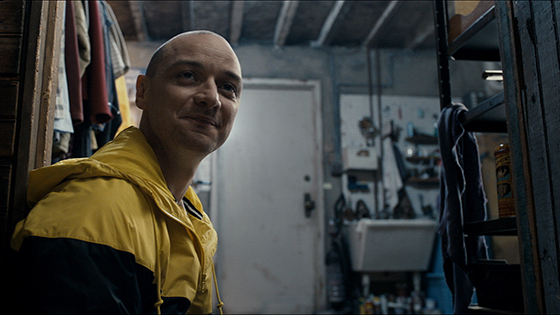
This screenshot has height=315, width=560. I want to click on sink, so click(392, 246).